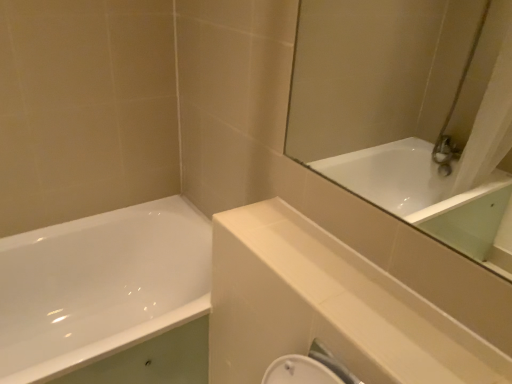
What do you see at coordinates (100, 286) in the screenshot?
I see `white glossy bathtub at left` at bounding box center [100, 286].

Locate an element on the screen. The height and width of the screenshot is (384, 512). white glossy bathtub at left is located at coordinates (100, 286).

This screenshot has height=384, width=512. Describe the element at coordinates (327, 307) in the screenshot. I see `white glossy balustrade at upper center` at that location.

Measure the distance between point (303, 311) and camera.

Point (303, 311) and camera are 34.65 inches apart.

This screenshot has height=384, width=512. In order to click on white glossy balustrade at upper center in this screenshot , I will do `click(327, 307)`.

Measure the distance between white glossy balustrade at upper center and camera.

The distance of white glossy balustrade at upper center from camera is 28.16 inches.

The width and height of the screenshot is (512, 384). I want to click on white glossy bathtub at left, so click(100, 286).

Between white glossy bathtub at left and white glossy balustrade at upper center, which one appears on the right side from the viewer's perspective?

white glossy balustrade at upper center.

Which object is further away from the camera taking this photo, white glossy bathtub at left or white glossy balustrade at upper center?

white glossy bathtub at left is further from the camera.

Is point (51, 282) farther from camera compared to point (282, 242)?

Yes.

From the image's perspective, is white glossy bathtub at left above or below white glossy balustrade at upper center?

Based on their image positions, white glossy bathtub at left is located beneath white glossy balustrade at upper center.

Looking at this image, from a real-world perspective, is white glossy bathtub at left on top of white glossy balustrade at upper center?

Incorrect, from a real-world perspective, white glossy bathtub at left is lower than white glossy balustrade at upper center.

Which object is thinner, white glossy bathtub at left or white glossy balustrade at upper center?

white glossy balustrade at upper center.

Is white glossy bathtub at left taller or shorter than white glossy balustrade at upper center?

white glossy bathtub at left is taller than white glossy balustrade at upper center.

Does white glossy bathtub at left have a smaller size compared to white glossy balustrade at upper center?

Incorrect, white glossy bathtub at left is not smaller in size than white glossy balustrade at upper center.

Do you think white glossy bathtub at left is within white glossy balustrade at upper center, or outside of it?

white glossy bathtub at left is spatially situated outside white glossy balustrade at upper center.

Are white glossy bathtub at left and white glossy balustrade at upper center far apart?

No, white glossy bathtub at left is not far from white glossy balustrade at upper center.

Is white glossy bathtub at left oriented towards white glossy balustrade at upper center?

No, white glossy bathtub at left is not facing towards white glossy balustrade at upper center.

You are a GUI agent. You are given a task and a screenshot of the screen. Output one action in this format:
    pyautogui.click(x=<x>, y=<y>)
    Task: Click on the bathtub that appears behind the white glossy balustrade at upper center
    
    Given the screenshot: What is the action you would take?
    pyautogui.click(x=100, y=286)

Can you confirm if white glossy balustrade at upper center is positioned to the left of white glossy bathtub at left?

No.

Looking at this image, is white glossy balustrade at upper center in front of or behind white glossy bathtub at left in the image?

white glossy balustrade at upper center is in front of white glossy bathtub at left.

Which is closer, [289,213] or [86,324]?

The point [289,213] is closer.

From the image's perspective, is white glossy balustrade at upper center on top of white glossy bathtub at left?

Indeed, from the image's perspective, white glossy balustrade at upper center is shown above white glossy bathtub at left.

From a real-world perspective, who is located higher, white glossy balustrade at upper center or white glossy bathtub at left?

white glossy balustrade at upper center.

Does white glossy balustrade at upper center have a lesser width compared to white glossy bathtub at left?

Correct, the width of white glossy balustrade at upper center is less than that of white glossy bathtub at left.

Is white glossy balustrade at upper center shorter than white glossy bathtub at left?

Correct, white glossy balustrade at upper center is not as tall as white glossy bathtub at left.

Is white glossy balustrade at upper center bigger or smaller than white glossy bathtub at left?

Considering their sizes, white glossy balustrade at upper center takes up less space than white glossy bathtub at left.

Is white glossy balustrade at upper center not inside white glossy bathtub at left?

Yes.

Is white glossy balustrade at upper center beside white glossy bathtub at left?

white glossy balustrade at upper center and white glossy bathtub at left are clearly separated.

In the scene shown: Is white glossy balustrade at upper center oriented away from white glossy bathtub at left?

No, white glossy balustrade at upper center's orientation is not away from white glossy bathtub at left.

How many degrees apart are the facing directions of white glossy balustrade at upper center and white glossy bathtub at left?

The angular difference between white glossy balustrade at upper center and white glossy bathtub at left is 89.7 degrees.

I want to click on bathtub below the white glossy balustrade at upper center (from the image's perspective), so click(x=100, y=286).

Identify the location of bathtub below the white glossy balustrade at upper center (from the image's perspective). The height and width of the screenshot is (384, 512). (100, 286).

At what (x,y) coordinates should I click in order to perform the action: click on balustrade above the white glossy bathtub at left (from the image's perspective). Please return your answer as a coordinate pair (x, y). Looking at the image, I should click on (327, 307).